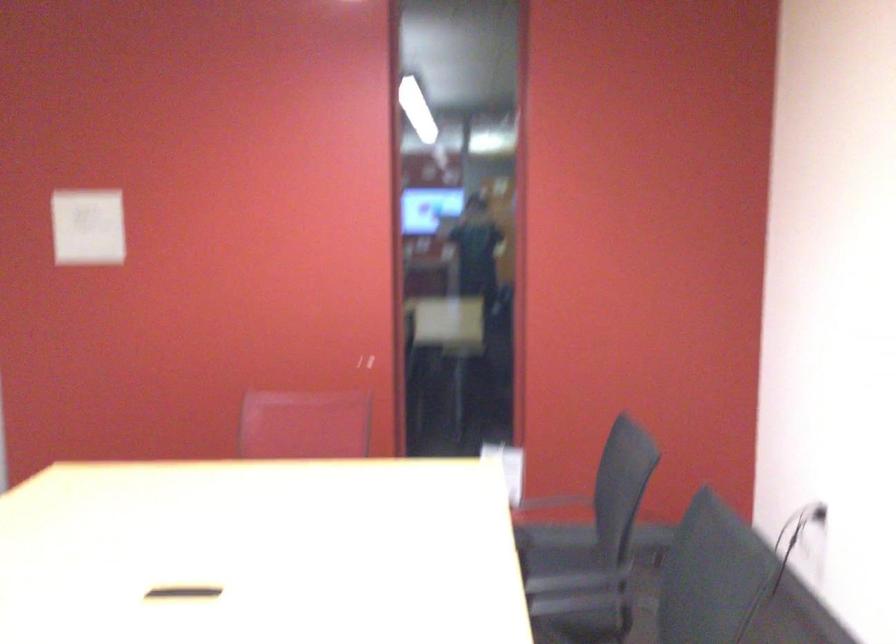
You are a GUI agent. You are given a task and a screenshot of the screen. Output one action in this format:
    pyautogui.click(x=<x>, y=<y>)
    Task: Click on the black chair sitting surface
    The height and width of the screenshot is (644, 896).
    Given the screenshot: What is the action you would take?
    pyautogui.click(x=554, y=547)